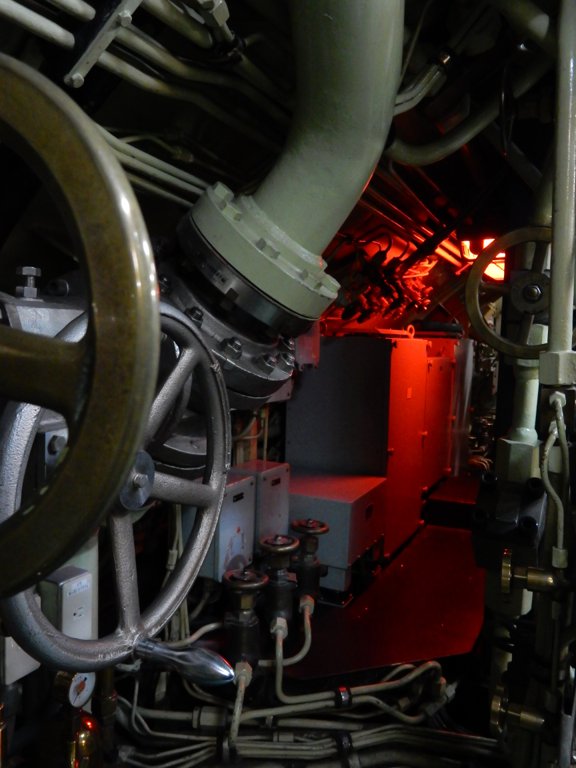
Find the location of a particular element. electrical boxes is located at coordinates (246, 524), (281, 520).